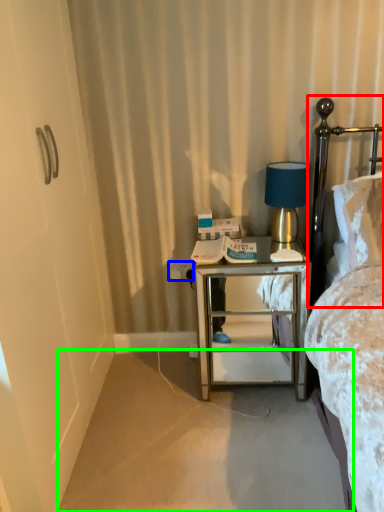
Question: Estimate the real-world distances between objects in this image. Which object is closer to headboard (highlighted by a red box), electric outlet (highlighted by a blue box) or plain (highlighted by a green box)?

Choices:
 (A) electric outlet
 (B) plain

Answer: (A)